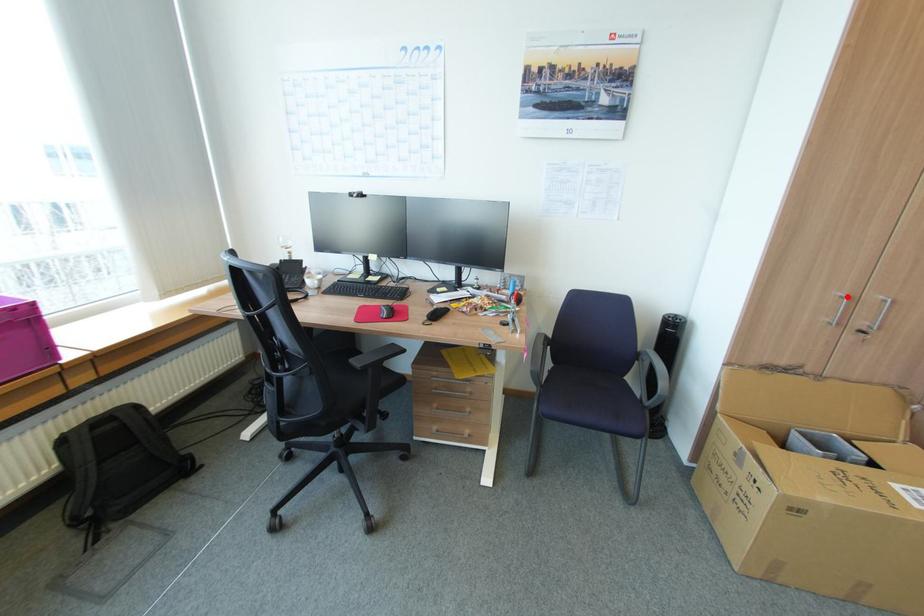
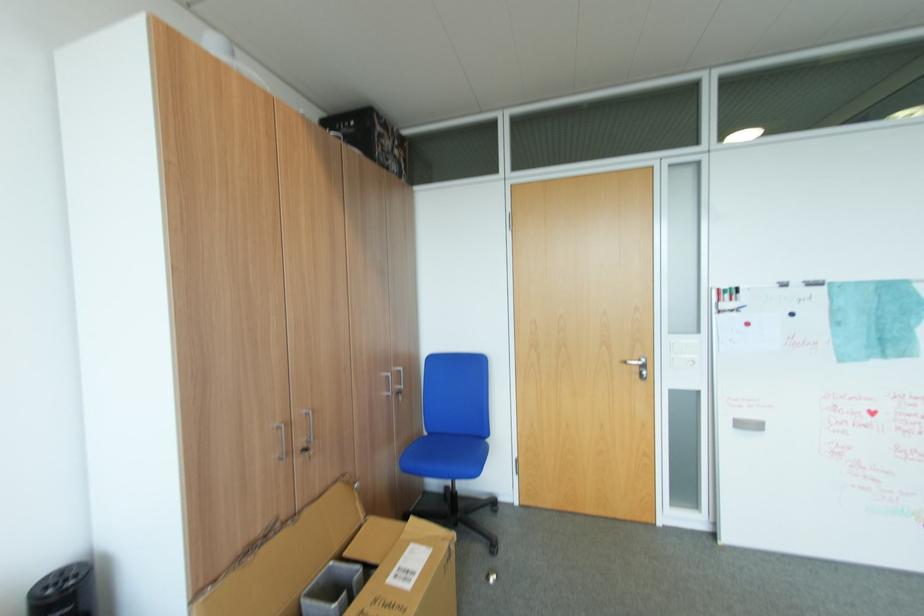
Find the pixel in the second image that matches the highlighted location in the first image.

(283, 430)